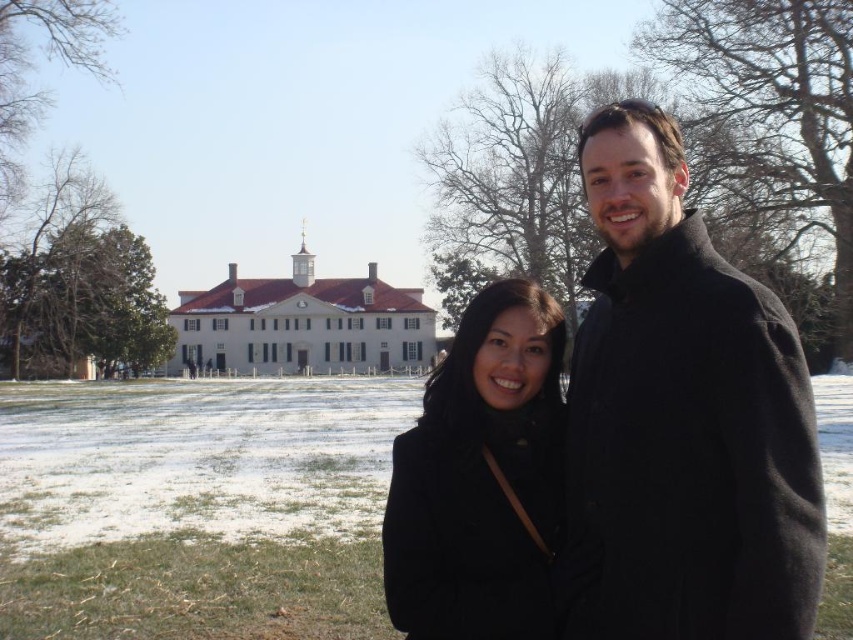
Is black wool coat at right shorter than black matte coat at center?

In fact, black wool coat at right may be taller than black matte coat at center.

Between point (602, 177) and point (463, 330), which one is positioned behind?

The point (463, 330) is behind.

Identify the location of black wool coat at right. (682, 419).